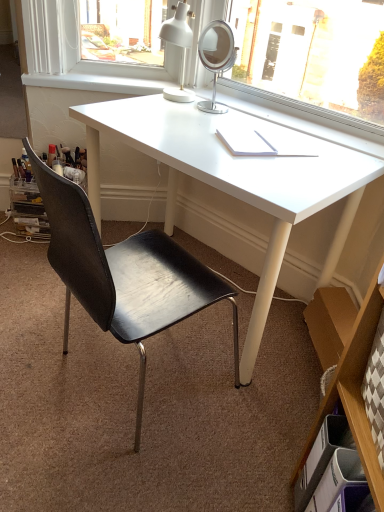
Locate an element on the screen. The height and width of the screenshot is (512, 384). free point below black leather chair at center (from a real-world perspective) is located at coordinates (119, 376).